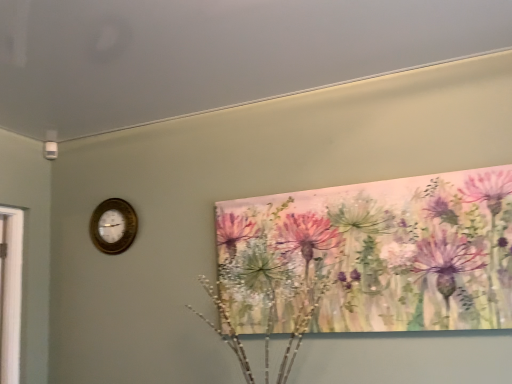
Question: From a real-world perspective, is watercolor flowers at upper right positioned above or below gold metallic wall clock at left?

Choices:
 (A) above
 (B) below

Answer: (B)

Question: In terms of height, does watercolor flowers at upper right look taller or shorter compared to gold metallic wall clock at left?

Choices:
 (A) short
 (B) tall

Answer: (B)

Question: From the image's perspective, is watercolor flowers at upper right positioned above or below gold metallic wall clock at left?

Choices:
 (A) above
 (B) below

Answer: (B)

Question: Which is correct: gold metallic wall clock at left is inside watercolor flowers at upper right, or outside of it?

Choices:
 (A) inside
 (B) outside

Answer: (B)

Question: In the image, is gold metallic wall clock at left positioned in front of or behind watercolor flowers at upper right?

Choices:
 (A) front
 (B) behind

Answer: (B)

Question: Considering the positions of gold metallic wall clock at left and watercolor flowers at upper right in the image, is gold metallic wall clock at left wider or thinner than watercolor flowers at upper right?

Choices:
 (A) thin
 (B) wide

Answer: (A)

Question: Looking at the image, does gold metallic wall clock at left seem bigger or smaller compared to watercolor flowers at upper right?

Choices:
 (A) big
 (B) small

Answer: (B)